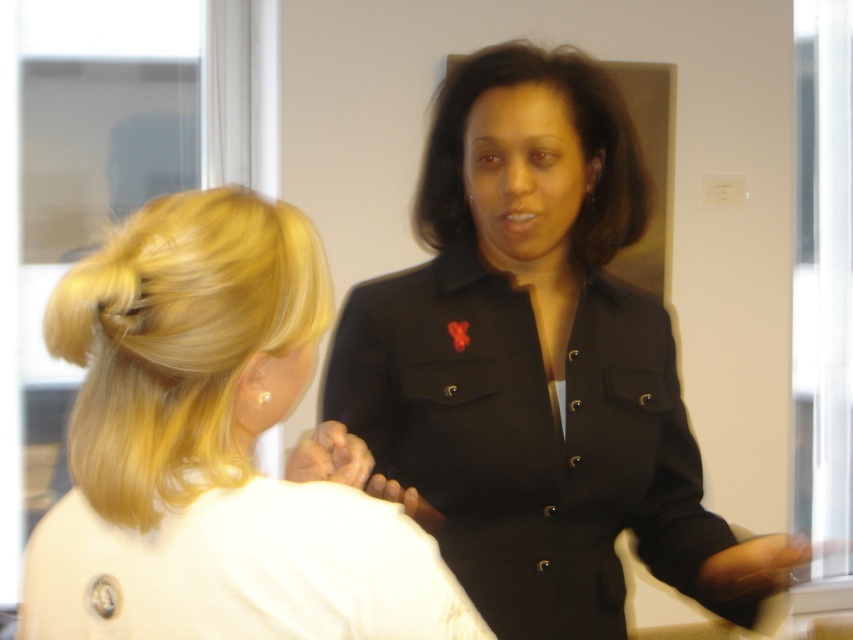
Question: Can you confirm if black matte jacket at center is positioned to the left of matte black blazer at upper right?

Choices:
 (A) yes
 (B) no

Answer: (B)

Question: Which object is closer to the camera taking this photo?

Choices:
 (A) black matte jacket at center
 (B) blonde silky hair at left

Answer: (B)

Question: Which point is closer to the camera?

Choices:
 (A) blonde silky hair at left
 (B) black matte jacket at center

Answer: (A)

Question: Can you confirm if black matte jacket at center is positioned to the left of blonde silky hair at left?

Choices:
 (A) yes
 (B) no

Answer: (B)

Question: Which object is farther from the camera taking this photo?

Choices:
 (A) blonde silky hair at left
 (B) black smooth hair at center

Answer: (B)

Question: Can you confirm if matte black blazer at upper right is positioned to the right of black smooth hair at center?

Choices:
 (A) no
 (B) yes

Answer: (A)